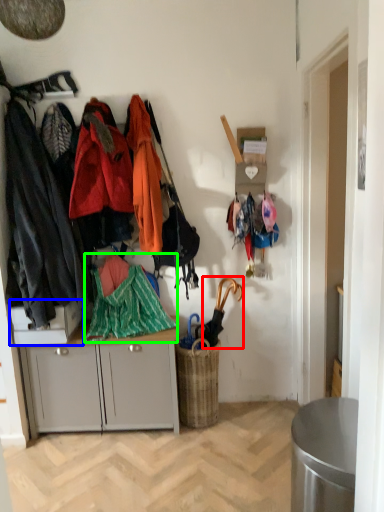
Question: Which object is positioned farthest from umbrella (highlighted by a red box)? Select from desk (highlighted by a blue box) and jacket (highlighted by a green box).

Choices:
 (A) desk
 (B) jacket

Answer: (A)